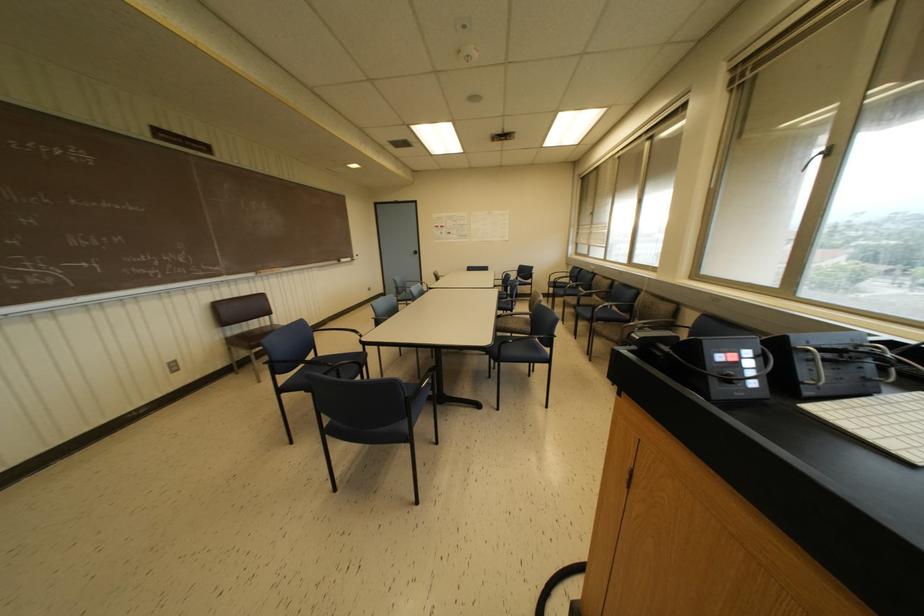
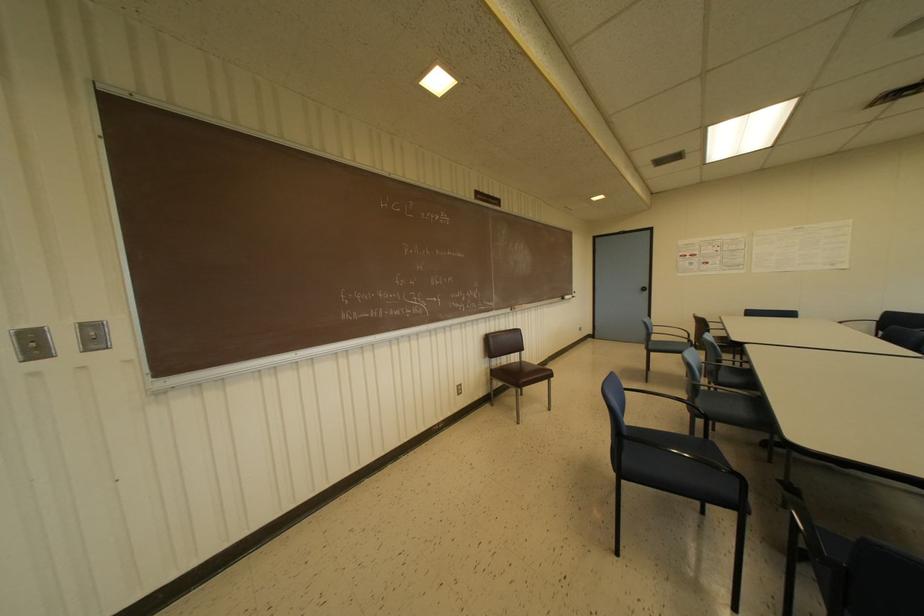
In the second image, find the point that corresponds to (272,325) in the first image.

(519, 362)